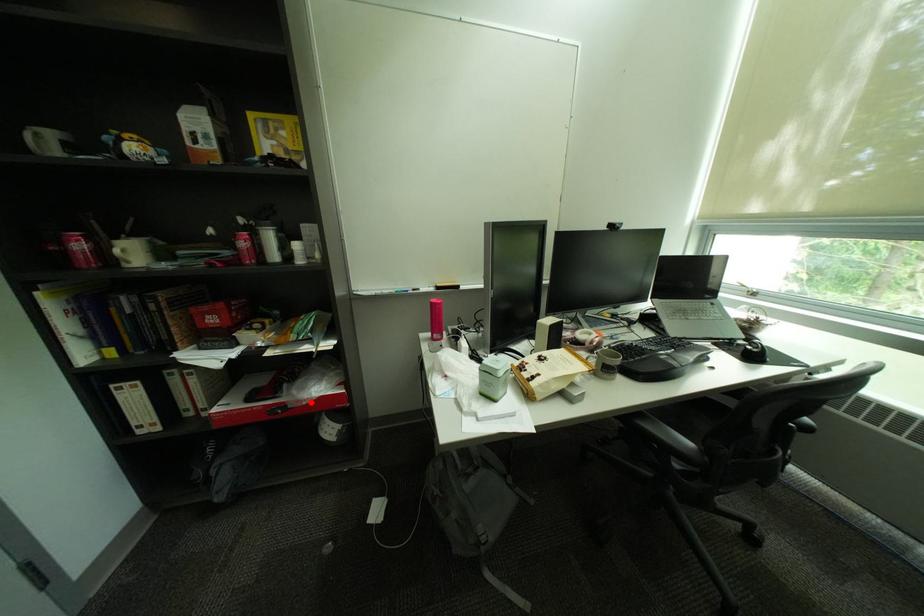
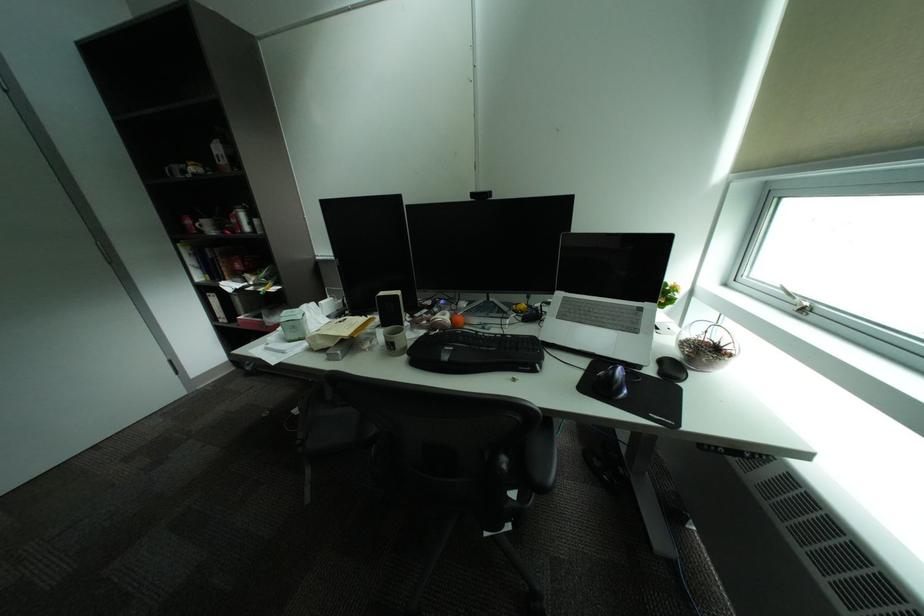
Question: I am providing you with two images of the same scene from different viewpoints. A red point is shown in image1. For the corresponding object point in image2, is it positioned nearer or farther from the camera?

Choices:
 (A) Nearer
 (B) Farther

Answer: (B)